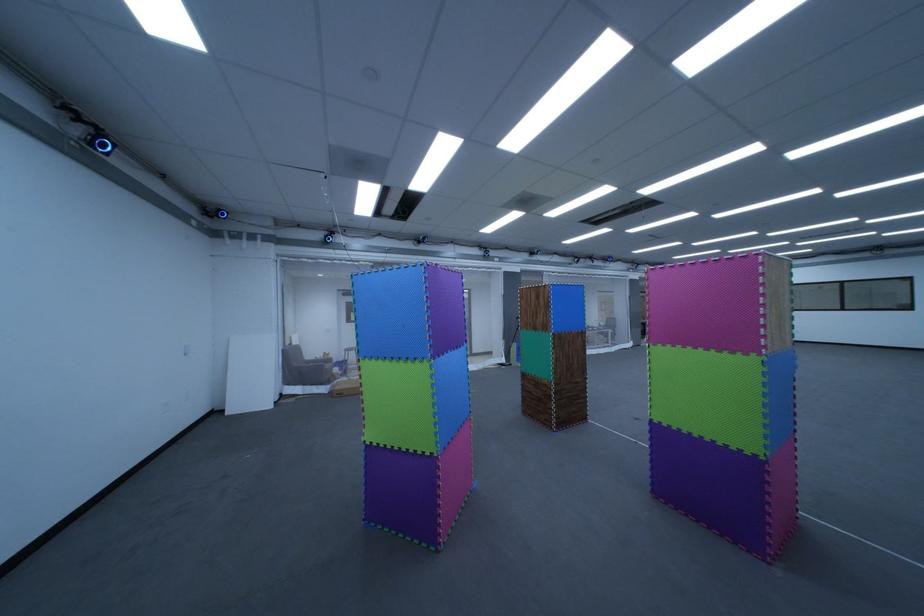
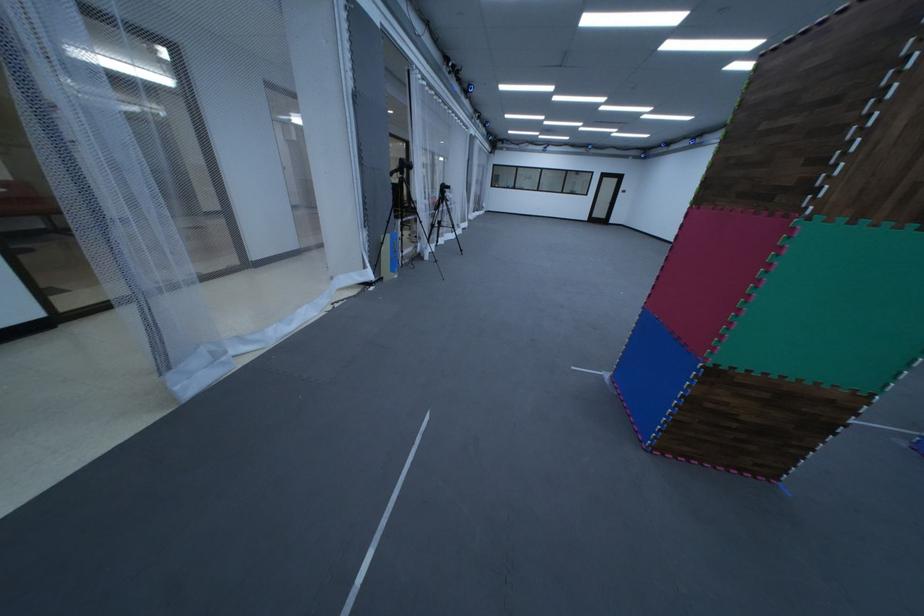
Find the pixel in the second image that matches (x=527, y=350) in the first image.

(398, 249)